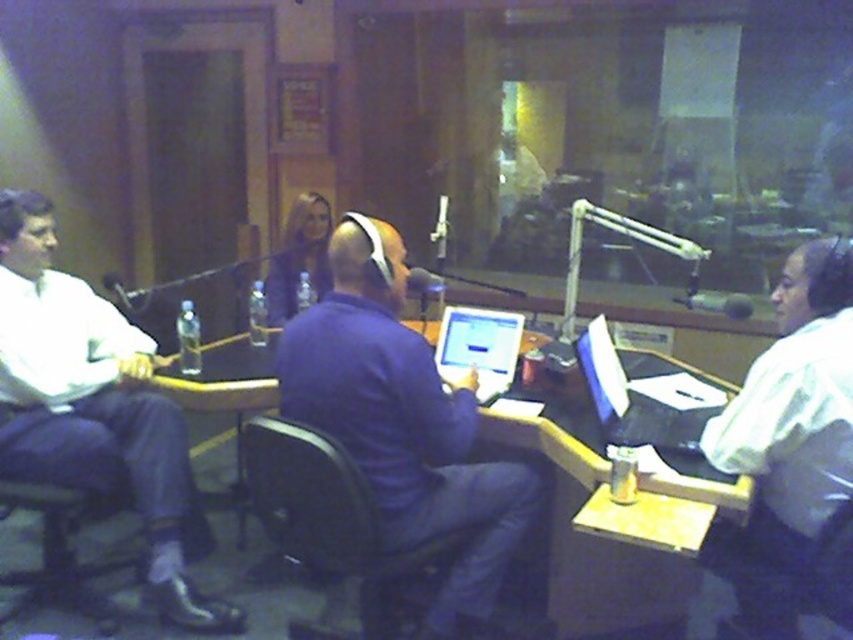
Question: Which point is closer to the camera taking this photo?

Choices:
 (A) (682, 404)
 (B) (641, 552)
 (C) (368, 584)
 (D) (474, 348)

Answer: (B)

Question: Estimate the real-world distances between objects in this image. Which object is closer to the black plastic swivel chair at center?

Choices:
 (A) matte silver laptop at center
 (B) smooth purple shirt at center

Answer: (A)

Question: Does purple matte shirt at center have a larger size compared to matte black microphone at center?

Choices:
 (A) yes
 (B) no

Answer: (A)

Question: Does smooth purple shirt at center appear over matte black microphone at center?

Choices:
 (A) yes
 (B) no

Answer: (A)

Question: Is wooden table at center positioned in front of smooth purple shirt at center?

Choices:
 (A) no
 (B) yes

Answer: (B)

Question: Which point is closer to the camera?

Choices:
 (A) black plastic swivel chair at center
 (B) shiny black laptop at right

Answer: (A)